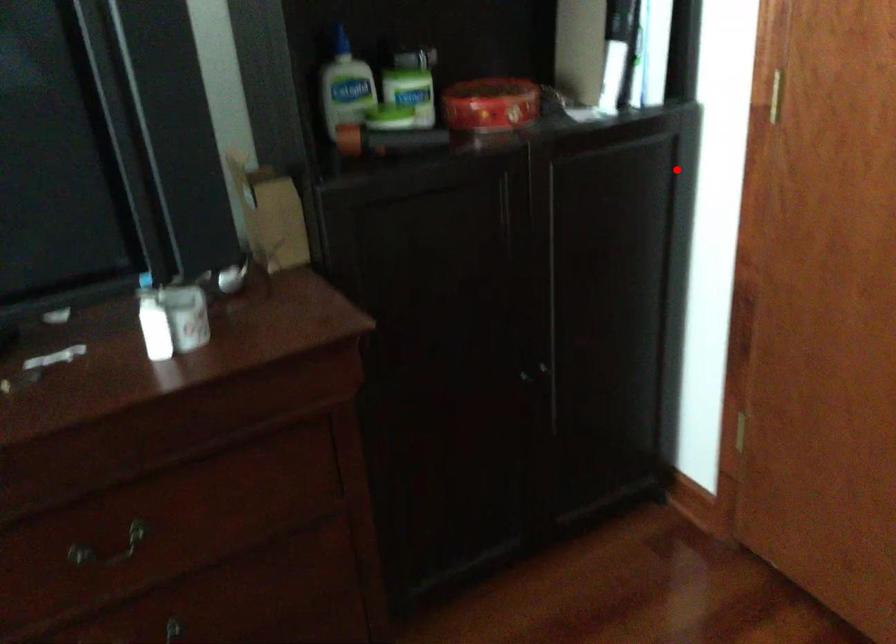
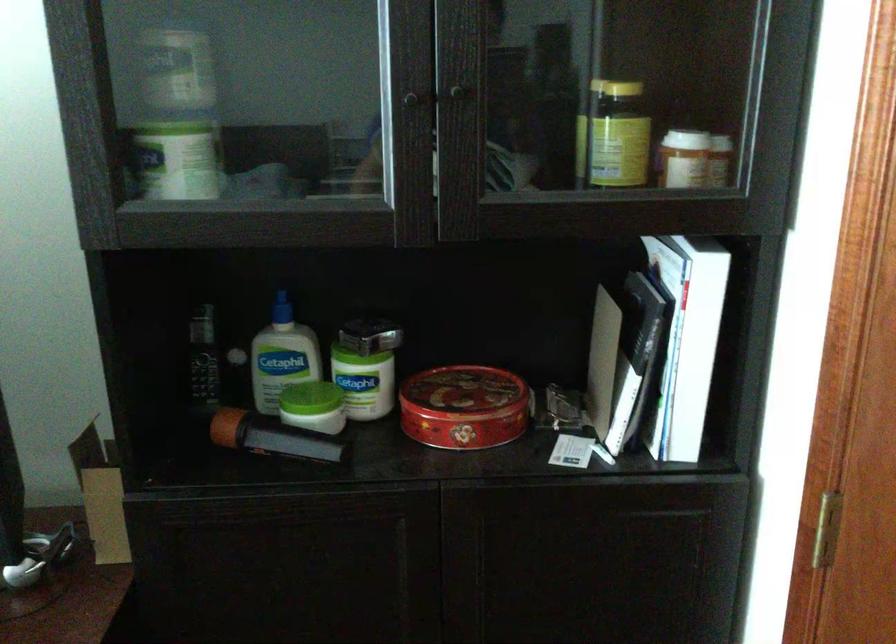
The point at the highlighted location is marked in the first image. Where is the corresponding point in the second image?

(707, 554)